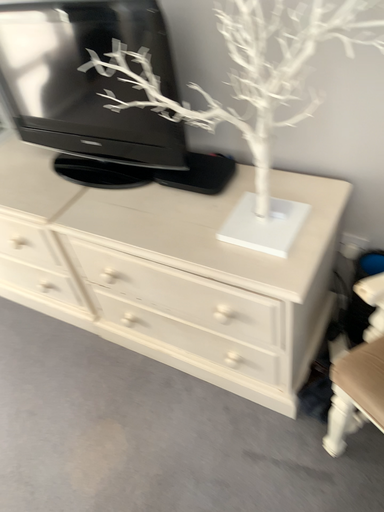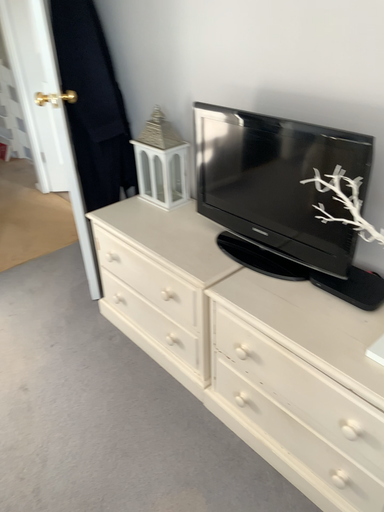
Question: How did the camera likely rotate when shooting the video?

Choices:
 (A) rotated upward
 (B) rotated downward

Answer: (A)